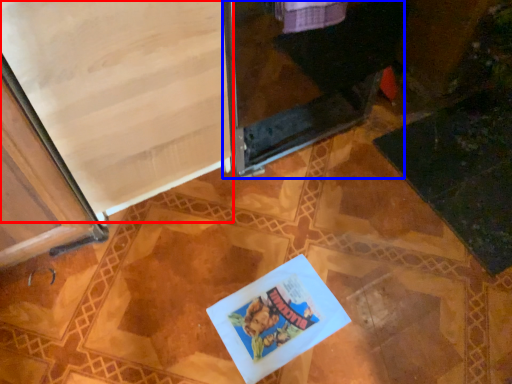
Question: Which object is further to the camera taking this photo, screen door (highlighted by a red box) or screen door (highlighted by a blue box)?

Choices:
 (A) screen door
 (B) screen door

Answer: (B)